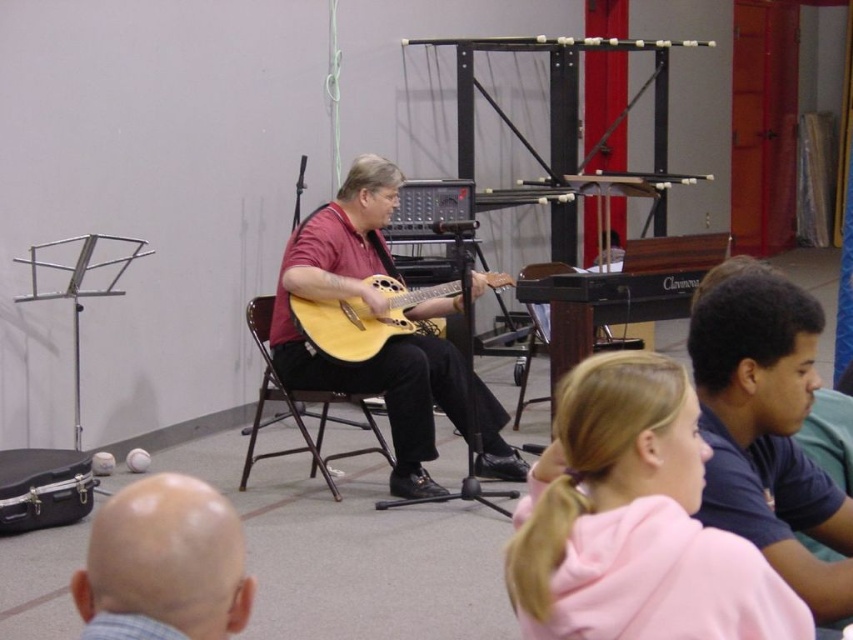
You are a music teacher who wants to adjust the distance between the matte wood guitar at center and the metallic silver chair at center so that they are exactly 40 centimeters apart. Given that they are currently 38.67 centimeters apart, how much space do you need to add or remove?

The current distance between the matte wood guitar at center and the metallic silver chair at center is 38.67 centimeters. To reach exactly 40 centimeters, you need to add 1.33 centimeters of space between them.

You are a photographer standing at the camera position. You want to capture a closeup shot of the matte wood guitar at center. Given that your camera has a minimum focusing distance of 2 meters, will you be able to take the photo without moving closer?

The distance between the matte wood guitar at center and the camera is 3.88 meters, which is greater than the minimum focusing distance of 2 meters. Therefore, you can take the photo without moving closer.

You are a photographer setting up for a group photo. You need to position yourself between the dark blue shirt at lower right and the light wood acoustic guitar at center. What is the minimum distance you should maintain between these two subjects to ensure they are both in frame?

The dark blue shirt at lower right and light wood acoustic guitar at center are 2.20 meters apart, so you should maintain at least 2.20 meters between them to ensure both are in frame.